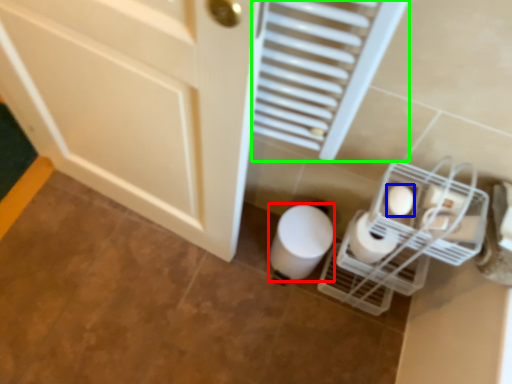
Question: Estimate the real-world distances between objects in this image. Which object is closer to toilet paper (highlighted by a red box), toilet paper (highlighted by a blue box) or radiator (highlighted by a green box)?

Choices:
 (A) toilet paper
 (B) radiator

Answer: (A)